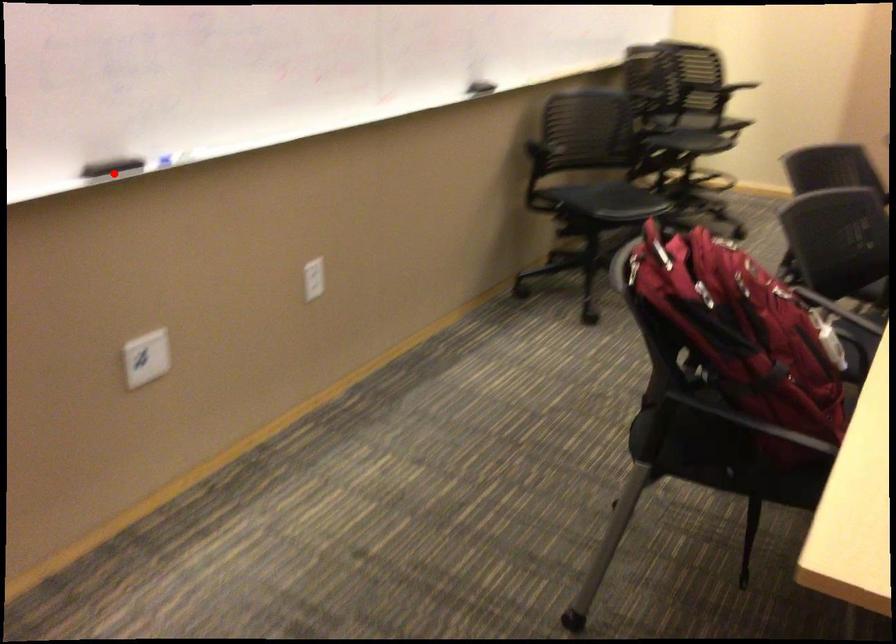
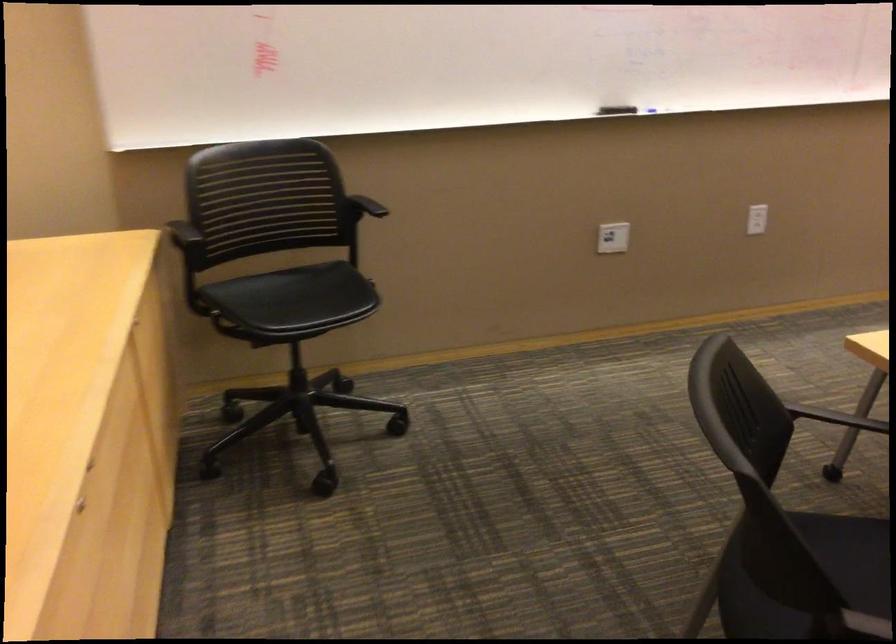
The point at the highlighted location is marked in the first image. Where is the corresponding point in the second image?

(616, 109)